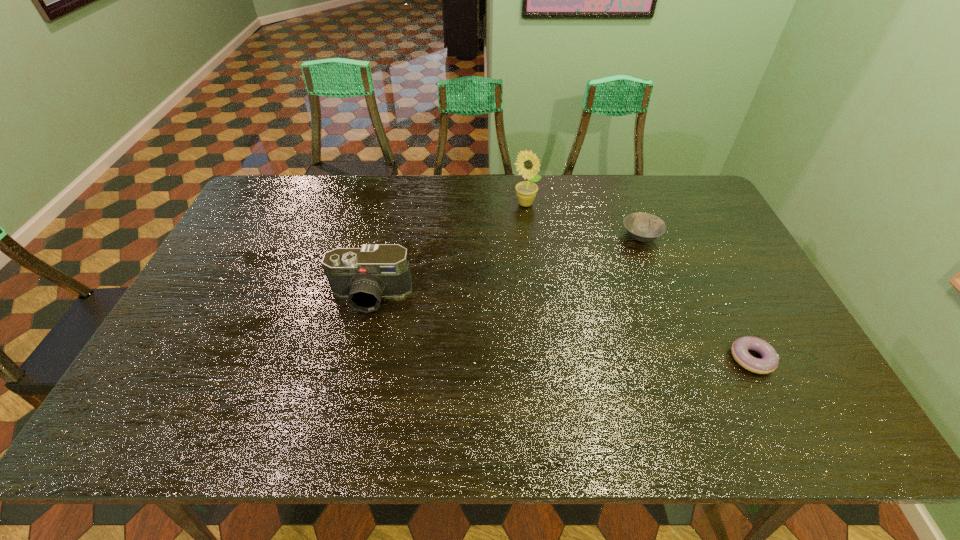
Point out which object is positioned as the second nearest to the doughnut. Please provide its 2D coordinates. Your answer should be formatted as a tuple, i.e. [(x, y)], where the tuple contains the x and y coordinates of a point satisfying the conditions above.

[(527, 164)]

The image size is (960, 540). Find the location of `vacant space that satisfies the following two spatial constraints: 1. on the front side of the second farthest object; 2. on the left side of the doughnut`. vacant space that satisfies the following two spatial constraints: 1. on the front side of the second farthest object; 2. on the left side of the doughnut is located at coordinates [x=688, y=359].

Where is `vacant space that satisfies the following two spatial constraints: 1. on the face of the third nearest object; 2. on the left side of the farthest object`? vacant space that satisfies the following two spatial constraints: 1. on the face of the third nearest object; 2. on the left side of the farthest object is located at coordinates (529, 236).

Where is `free spot that satisfies the following two spatial constraints: 1. on the front-facing side of the third shortest object; 2. on the left side of the shortest object`? free spot that satisfies the following two spatial constraints: 1. on the front-facing side of the third shortest object; 2. on the left side of the shortest object is located at coordinates (356, 359).

This screenshot has height=540, width=960. What are the coordinates of `vacant space that satisfies the following two spatial constraints: 1. on the face of the farthest object; 2. on the left side of the rightmost object` in the screenshot? It's located at (543, 359).